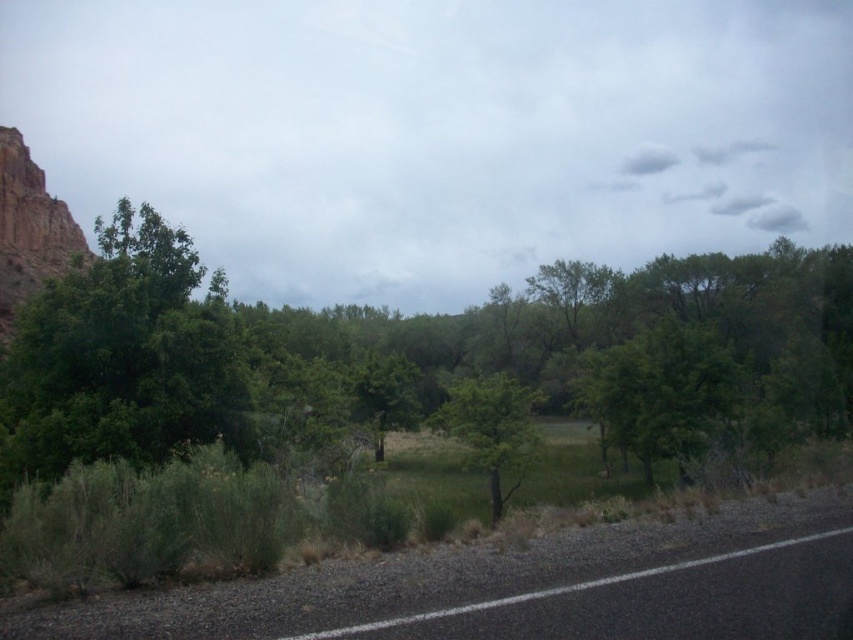
Does green leafy tree at left have a larger size compared to rustic brown cliff at left?

Yes, green leafy tree at left is bigger than rustic brown cliff at left.

Which is in front, point (7, 380) or point (74, 243)?

Point (7, 380) is in front.

Identify the location of green leafy tree at left. (125, 356).

Does rustic brown cliff at left come in front of black asphalt road at lower right?

No.

Which of these two, rustic brown cliff at left or black asphalt road at lower right, stands taller?

rustic brown cliff at left is taller.

Locate an element on the screen. This screenshot has height=640, width=853. rustic brown cliff at left is located at coordinates (28, 228).

Is point (489, 454) farther from viewer compared to point (692, 561)?

Yes, it is behind point (692, 561).

Is green leafy tree at center wider than black asphalt road at lower right?

Correct, the width of green leafy tree at center exceeds that of black asphalt road at lower right.

In order to click on green leafy tree at center in this screenshot , I will do `click(490, 429)`.